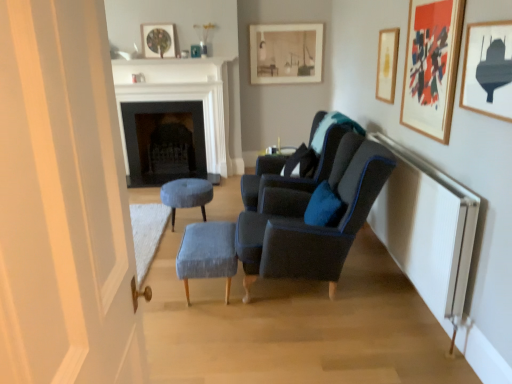
This screenshot has height=384, width=512. What are the coordinates of `vacant point above white textured radiator at right (from a real-world perspective)` in the screenshot? It's located at 429,172.